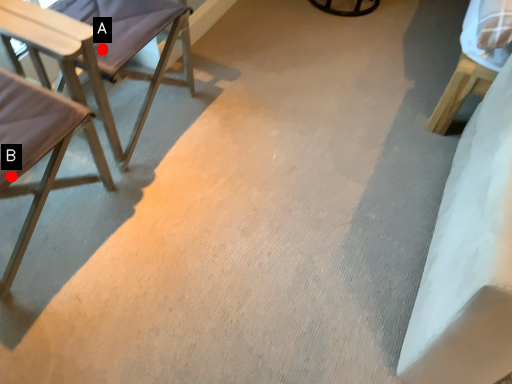
Question: Two points are circled on the image, labeled by A and B beside each circle. Which point appears farthest from the camera in this image?

Choices:
 (A) A is further
 (B) B is further

Answer: (A)